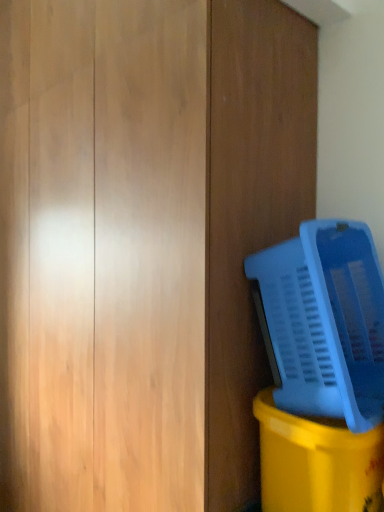
Question: From a real-world perspective, is matte plastic basket at lower right positioned above or below blue plastic basket at right?

Choices:
 (A) above
 (B) below

Answer: (B)

Question: Based on their sizes in the image, would you say matte plastic basket at lower right is bigger or smaller than blue plastic basket at right?

Choices:
 (A) small
 (B) big

Answer: (A)

Question: In terms of width, does matte plastic basket at lower right look wider or thinner when compared to blue plastic basket at right?

Choices:
 (A) thin
 (B) wide

Answer: (A)

Question: Based on their positions, is blue plastic basket at right located to the left or right of matte plastic basket at lower right?

Choices:
 (A) right
 (B) left

Answer: (B)

Question: Is point (354, 331) positioned closer to the camera than point (319, 455)?

Choices:
 (A) farther
 (B) closer

Answer: (A)

Question: In terms of size, does blue plastic basket at right appear bigger or smaller than matte plastic basket at lower right?

Choices:
 (A) big
 (B) small

Answer: (A)

Question: From the image's perspective, is blue plastic basket at right positioned above or below matte plastic basket at lower right?

Choices:
 (A) above
 (B) below

Answer: (A)